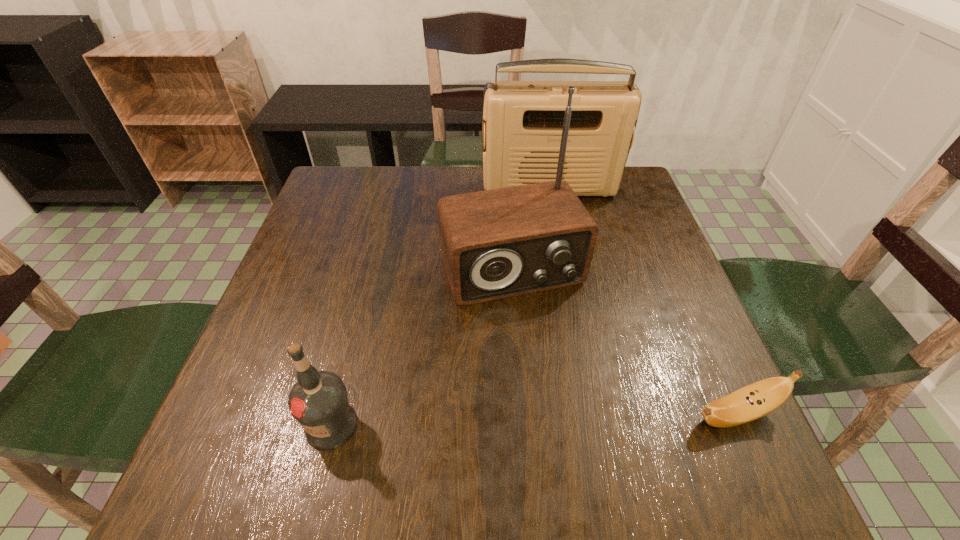
Identify the location of the leftmost object. (319, 402).

Locate an element on the screen. This screenshot has width=960, height=540. vodka is located at coordinates (319, 402).

Locate an element on the screen. The height and width of the screenshot is (540, 960). banana is located at coordinates (758, 399).

In order to click on the second farthest object in this screenshot , I will do `click(499, 243)`.

Locate an element on the screen. This screenshot has height=540, width=960. the farther radio receiver is located at coordinates (524, 120).

This screenshot has height=540, width=960. What are the coordinates of `blank space located on the left of the shortest object` in the screenshot? It's located at (530, 414).

The image size is (960, 540). In order to click on blank space located on the front-facing side of the second farthest object in this screenshot , I will do `click(544, 332)`.

Identify the location of vacant area situated on the front-facing side of the second farthest object. The width and height of the screenshot is (960, 540). (540, 324).

Where is `vacant space located 0.160m on the front-facing side of the second farthest object`? The image size is (960, 540). vacant space located 0.160m on the front-facing side of the second farthest object is located at coordinates (560, 368).

Locate an element on the screen. The width and height of the screenshot is (960, 540). free space located on the front-facing side of the farther radio receiver is located at coordinates coord(569,289).